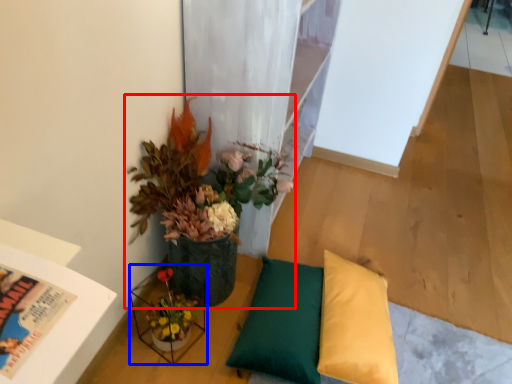
Question: Which point is closer to the camera, houseplant (highlighted by a red box) or vase (highlighted by a blue box)?

Choices:
 (A) houseplant
 (B) vase

Answer: (A)